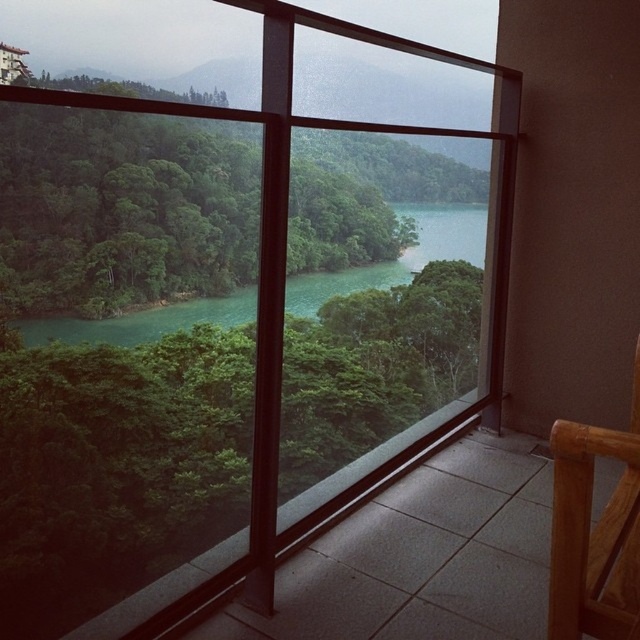
Is green leafy tree at center to the left of bamboo chair at lower right from the viewer's perspective?

Indeed, green leafy tree at center is positioned on the left side of bamboo chair at lower right.

What do you see at coordinates (122, 209) in the screenshot? The width and height of the screenshot is (640, 640). I see `green leafy tree at center` at bounding box center [122, 209].

Image resolution: width=640 pixels, height=640 pixels. In order to click on green leafy tree at center in this screenshot , I will do point(122,209).